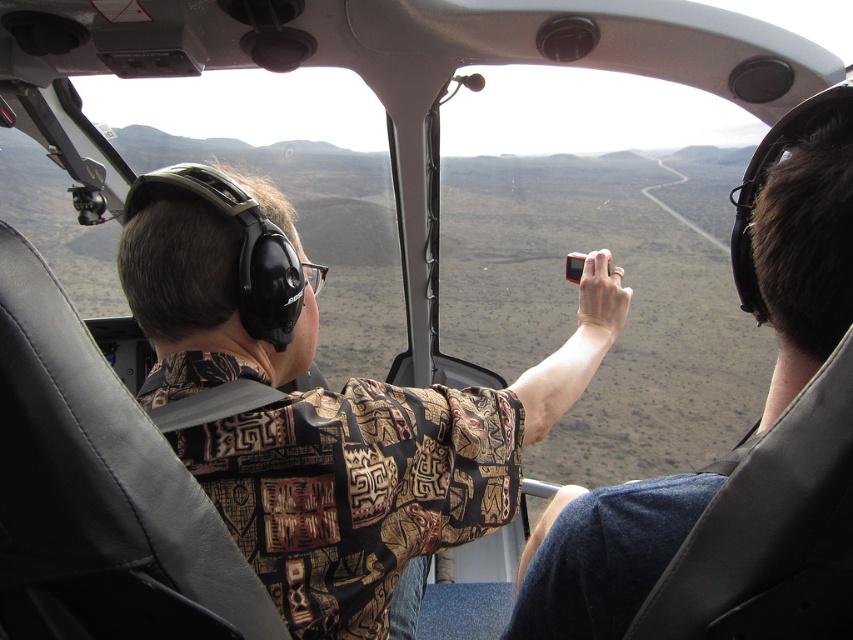
Which is more to the right, patterned fabric shirt at center or matte black camera at right?

matte black camera at right is more to the right.

Does patterned fabric shirt at center appear on the left side of matte black camera at right?

Correct, you'll find patterned fabric shirt at center to the left of matte black camera at right.

The width and height of the screenshot is (853, 640). I want to click on patterned fabric shirt at center, so click(x=384, y=472).

Image resolution: width=853 pixels, height=640 pixels. What are the coordinates of `patterned fabric shirt at center` in the screenshot? It's located at (384, 472).